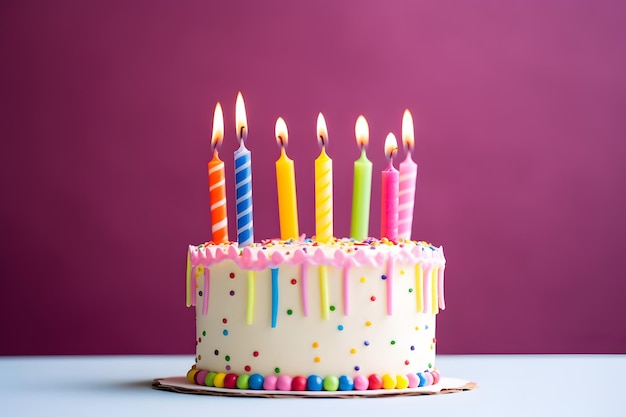
This screenshot has width=626, height=417. Identify the location of candle. (216, 187), (238, 178), (290, 181), (321, 186), (360, 191), (385, 198), (411, 192).